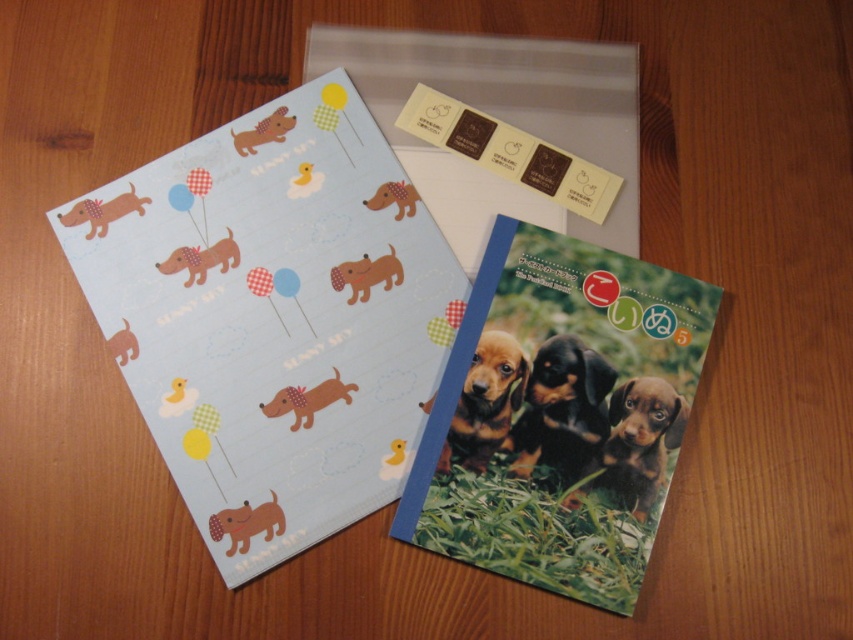
You are trying to mail a package and need to know if the brown fur puppy at center can fit on top of the printed paper postcard at center without overlapping the edges. Based on their sizes, can it fit?

The printed paper postcard at center is larger than the brown fur puppy at center, so the puppy can fit on top without overlapping the edges.

You are organizing a craft project and need to arrange the items. You have a printed paper postcard at center and a brown fur puppy at center. Which item should you move first to place them in the correct order according to the scene?

The printed paper postcard at center is located above the brown fur puppy at center, so you should move the brown fur puppy at center first to place them in the correct order according to the scene.

You are looking at the decorative paper with the dachshund dogs. There are two points marked on it. One is at coordinate point (x=213, y=474) and the other is at point (x=462, y=392). Which of these points is nearer to you?

Point (x=213, y=474) is closer to the camera than point (x=462, y=392), so the point at (x=213, y=474) is nearer to you.